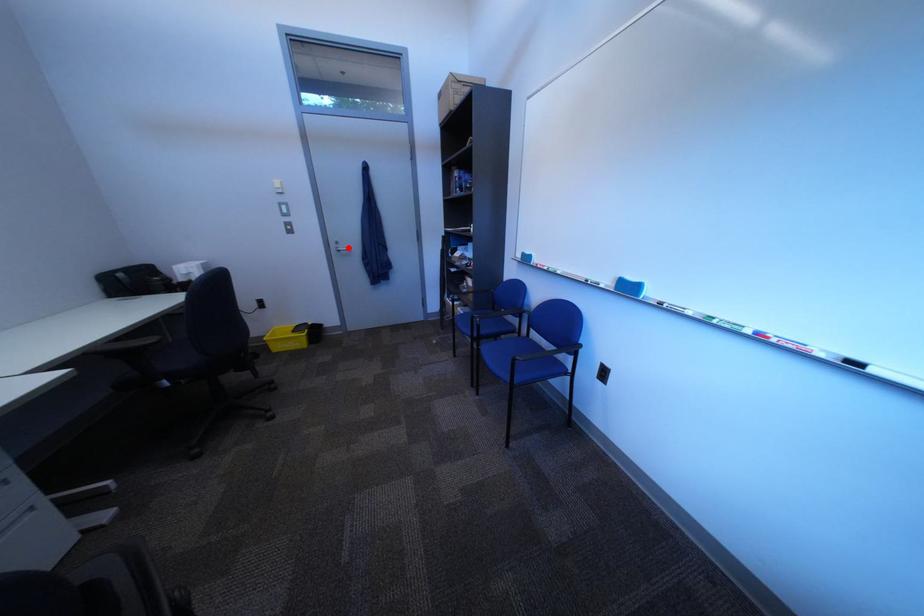
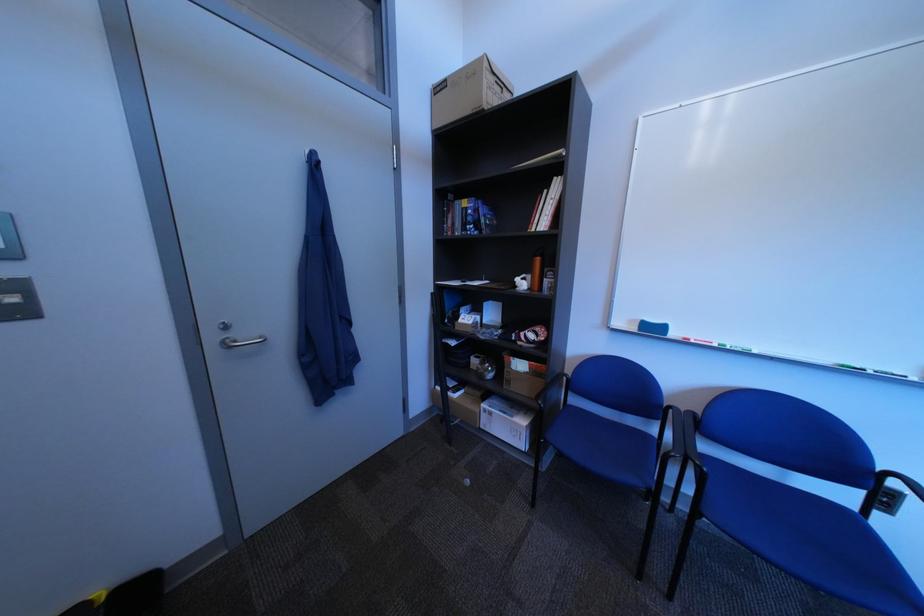
Find the pixel in the second image that matches the highlighted location in the first image.

(226, 339)